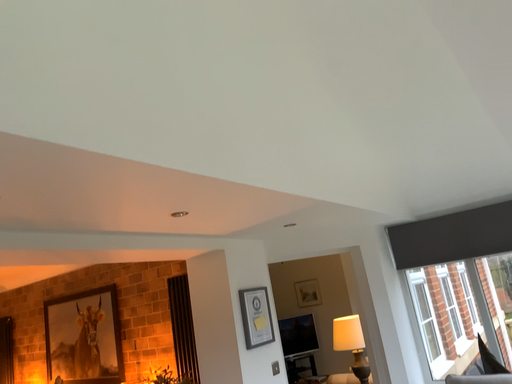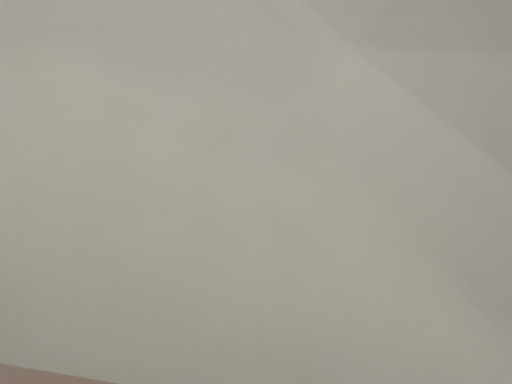
Question: Which way did the camera rotate in the video?

Choices:
 (A) rotated left
 (B) rotated right

Answer: (A)